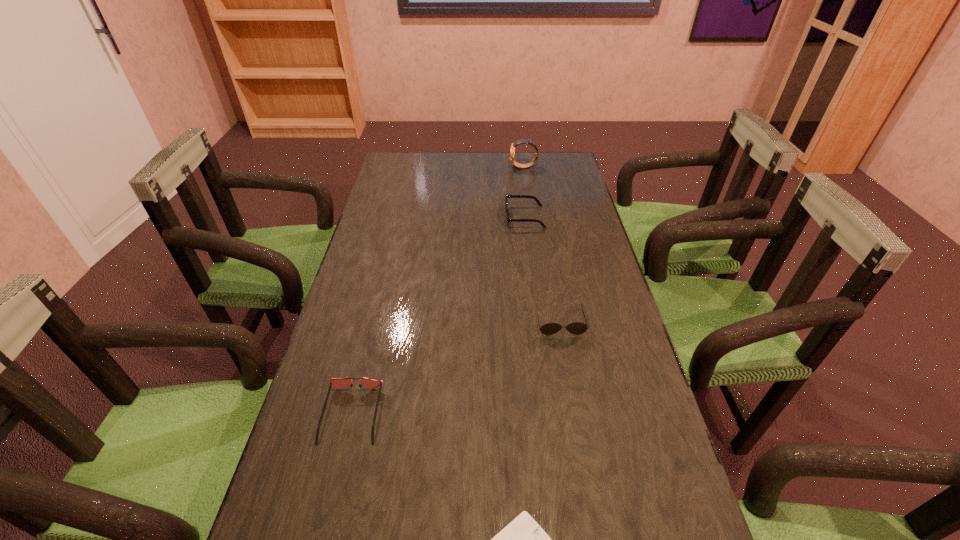
This screenshot has width=960, height=540. Find the location of `sunglasses that is the closest to the farthest sunglasses`. sunglasses that is the closest to the farthest sunglasses is located at coordinates (577, 328).

This screenshot has height=540, width=960. Find the location of `sunglasses that is the second closest to the diary`. sunglasses that is the second closest to the diary is located at coordinates (577, 328).